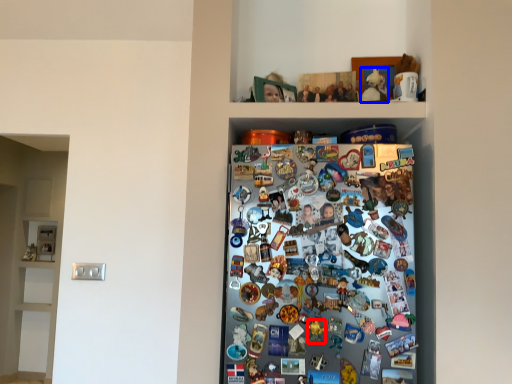
Question: Which of the following is the closest to the observer, toy (highlighted by a red box) or toy (highlighted by a blue box)?

Choices:
 (A) toy
 (B) toy

Answer: (A)